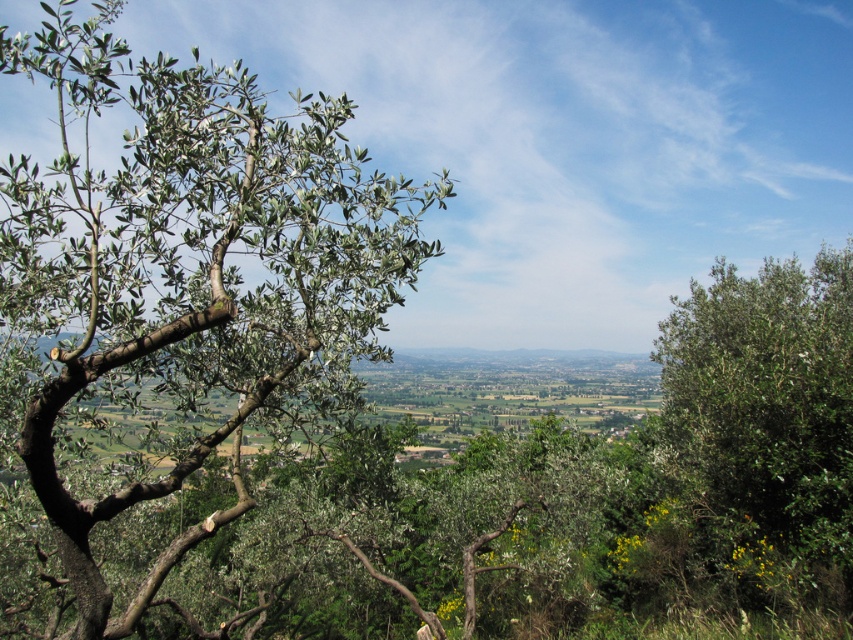
Can you confirm if green leafy tree at left is bigger than green leafy tree at right?

Yes.

Between point (45, 515) and point (663, 412), which one is positioned behind?

Positioned behind is point (663, 412).

The width and height of the screenshot is (853, 640). In order to click on green leafy tree at left in this screenshot , I will do `click(173, 310)`.